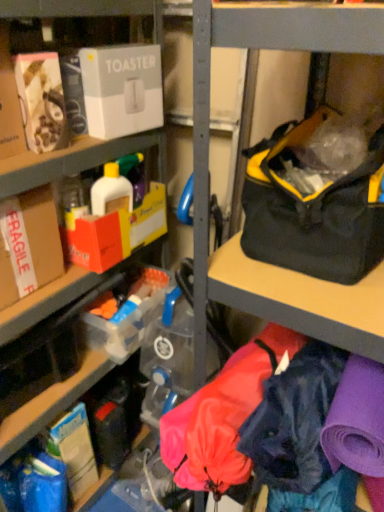
Measure the distance between matte black toaster at upper left and camera.

They are 32.92 inches apart.

What are the coordinates of `white cardboard toaster at upper left, the second box positioned from the bottom` in the screenshot? It's located at tap(122, 90).

Locate an element on the screen. The height and width of the screenshot is (512, 384). matte black toaster at upper left is located at coordinates (71, 160).

Locate an element on the screen. The height and width of the screenshot is (512, 384). handbag in front of the brown cardboard box at left, which is the second box in top-to-bottom order is located at coordinates (318, 196).

How different are the orientations of black/yellow fabric bag at right and brown cardboard box at left, which is the second box in top-to-bottom order, in degrees?

The angle between the facing direction of black/yellow fabric bag at right and the facing direction of brown cardboard box at left, which is the second box in top-to-bottom order, is 89.5 degrees.

Is the depth of black/yellow fabric bag at right greater than that of brown cardboard box at left, which is the second box in right-to-left order?

No, it is not.

Can we say black/yellow fabric bag at right lies outside brown cardboard box at left, which is the second box in top-to-bottom order?

Yes.

This screenshot has height=512, width=384. What are the coordinates of `shelf located on the left of white cardboard toaster at upper left, the 1th box from the right` in the screenshot? It's located at (71, 160).

Which of these two, white cardboard toaster at upper left, arranged as the first box when viewed from the top, or matte black toaster at upper left, stands taller?

Standing taller between the two is matte black toaster at upper left.

From the image's perspective, is white cardboard toaster at upper left, the second box positioned from the bottom, located above matte black toaster at upper left?

Correct, white cardboard toaster at upper left, the second box positioned from the bottom, appears higher than matte black toaster at upper left in the image.

In the scene shown: Considering the sizes of objects white cardboard toaster at upper left, arranged as the first box when viewed from the top, and matte black toaster at upper left in the image provided, who is bigger, white cardboard toaster at upper left, arranged as the first box when viewed from the top, or matte black toaster at upper left?

Bigger between the two is matte black toaster at upper left.

Is brown cardboard box at left, positioned as the first box in bottom-to-top order, facing away from black/yellow fabric bag at right?

No, black/yellow fabric bag at right is not at the back of brown cardboard box at left, positioned as the first box in bottom-to-top order.

How many degrees apart are the facing directions of brown cardboard box at left, which is the second box in top-to-bottom order, and black/yellow fabric bag at right?

There is a 89.5-degree angle between the facing directions of brown cardboard box at left, which is the second box in top-to-bottom order, and black/yellow fabric bag at right.

Considering their positions, is brown cardboard box at left, positioned as the first box in bottom-to-top order, located in front of or behind black/yellow fabric bag at right?

In the image, brown cardboard box at left, positioned as the first box in bottom-to-top order, appears behind black/yellow fabric bag at right.

Find the location of a particular element. The image size is (384, 512). handbag above the brown cardboard box at left, which is the second box in right-to-left order (from a real-world perspective) is located at coordinates (318, 196).

Which of these two, matte black toaster at upper left or white cardboard toaster at upper left, the second box positioned from the bottom, is smaller?

Smaller between the two is white cardboard toaster at upper left, the second box positioned from the bottom.

Is there a large distance between matte black toaster at upper left and white cardboard toaster at upper left, the second box positioned from the bottom?

No, matte black toaster at upper left is not far away from white cardboard toaster at upper left, the second box positioned from the bottom.

Is matte black toaster at upper left to the left or to the right of white cardboard toaster at upper left, arranged as the first box when viewed from the top, in the image?

From the image, it's evident that matte black toaster at upper left is to the left of white cardboard toaster at upper left, arranged as the first box when viewed from the top.

In the scene shown: From the image's perspective, between white cardboard toaster at upper left, the second box positioned from the bottom, and black/yellow fabric bag at right, who is located below?

From the image's view, black/yellow fabric bag at right is below.

Can you see white cardboard toaster at upper left, arranged as the first box when viewed from the top, touching black/yellow fabric bag at right?

white cardboard toaster at upper left, arranged as the first box when viewed from the top, and black/yellow fabric bag at right are clearly separated.

Which object is further away from the camera taking this photo, white cardboard toaster at upper left, arranged as the first box when viewed from the top, or black/yellow fabric bag at right?

white cardboard toaster at upper left, arranged as the first box when viewed from the top, is behind.

Considering the sizes of objects white cardboard toaster at upper left, the second box positioned from the bottom, and black/yellow fabric bag at right in the image provided, who is shorter, white cardboard toaster at upper left, the second box positioned from the bottom, or black/yellow fabric bag at right?

white cardboard toaster at upper left, the second box positioned from the bottom.

How distant is matte black toaster at upper left from black/yellow fabric bag at right?

A distance of 19.35 inches exists between matte black toaster at upper left and black/yellow fabric bag at right.

From the picture: Is matte black toaster at upper left taller than black/yellow fabric bag at right?

Yes, matte black toaster at upper left is taller than black/yellow fabric bag at right.

The image size is (384, 512). In order to click on shelf below the black/yellow fabric bag at right (from a real-world perspective) in this screenshot , I will do [x=71, y=160].

Can you confirm if matte black toaster at upper left is positioned to the right of black/yellow fabric bag at right?

Incorrect, matte black toaster at upper left is not on the right side of black/yellow fabric bag at right.

Could you tell me if black/yellow fabric bag at right is facing matte black toaster at upper left?

No, black/yellow fabric bag at right is not facing towards matte black toaster at upper left.

From a real-world perspective, is black/yellow fabric bag at right physically located above or below matte black toaster at upper left?

In terms of real-world spatial position, black/yellow fabric bag at right is above matte black toaster at upper left.

Is black/yellow fabric bag at right further to camera compared to matte black toaster at upper left?

Yes.

From the black/yellow fabric bag at right, count 1st boxs backward and point to it. Please provide its 2D coordinates.

[(28, 244)]

This screenshot has width=384, height=512. Identify the location of the 2nd box located above the matte black toaster at upper left (from a real-world perspective). (122, 90).

Considering their positions, is brown cardboard box at left, which is the second box in right-to-left order, positioned closer to white cardboard toaster at upper left, acting as the second box starting from the left, than matte black toaster at upper left?

matte black toaster at upper left lies closer to white cardboard toaster at upper left, acting as the second box starting from the left, than the other object.

When comparing their distances from black/yellow fabric bag at right, does brown cardboard box at left, which is the second box in right-to-left order, or matte black toaster at upper left seem further?

brown cardboard box at left, which is the second box in right-to-left order, is further to black/yellow fabric bag at right.

Looking at the image, which one is located closer to brown cardboard box at left, positioned as the first box in bottom-to-top order, black/yellow fabric bag at right or matte black toaster at upper left?

Based on the image, matte black toaster at upper left appears to be nearer to brown cardboard box at left, positioned as the first box in bottom-to-top order.

Considering their positions, is matte black toaster at upper left positioned closer to white cardboard toaster at upper left, acting as the second box starting from the left, than black/yellow fabric bag at right?

matte black toaster at upper left.

Based on the photo, considering their positions, is matte black toaster at upper left positioned closer to black/yellow fabric bag at right than white cardboard toaster at upper left, the 1th box from the right?

white cardboard toaster at upper left, the 1th box from the right.

From the image, which object appears to be nearer to black/yellow fabric bag at right, brown cardboard box at left, which is the second box in right-to-left order, or white cardboard toaster at upper left, the second box positioned from the bottom?

white cardboard toaster at upper left, the second box positioned from the bottom, is positioned closer to the anchor black/yellow fabric bag at right.

Which object lies nearer to the anchor point white cardboard toaster at upper left, arranged as the first box when viewed from the top, black/yellow fabric bag at right or matte black toaster at upper left?

The object closer to white cardboard toaster at upper left, arranged as the first box when viewed from the top, is matte black toaster at upper left.

Looking at the image, which one is located further to white cardboard toaster at upper left, the second box positioned from the bottom, matte black toaster at upper left or brown cardboard box at left, which is the second box in top-to-bottom order?

brown cardboard box at left, which is the second box in top-to-bottom order, is further to white cardboard toaster at upper left, the second box positioned from the bottom.

This screenshot has height=512, width=384. I want to click on shelf between brown cardboard box at left, positioned as the first box in bottom-to-top order, and black/yellow fabric bag at right, in the horizontal direction, so click(x=71, y=160).

Image resolution: width=384 pixels, height=512 pixels. I want to click on box between brown cardboard box at left, which is the second box in top-to-bottom order, and black/yellow fabric bag at right, in the horizontal direction, so click(122, 90).

The image size is (384, 512). I want to click on box between matte black toaster at upper left and black/yellow fabric bag at right, so click(x=122, y=90).

Locate an element on the screen. box between white cardboard toaster at upper left, acting as the second box starting from the left, and matte black toaster at upper left vertically is located at coordinates (28, 244).